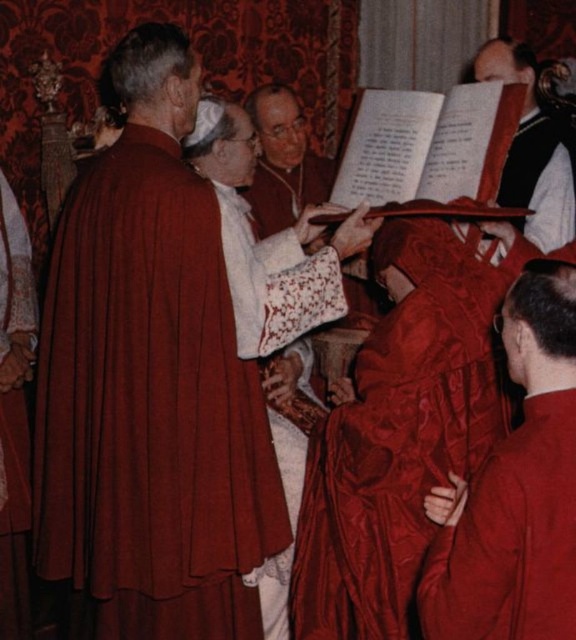
Question: Is matte red robe at left behind satin red robe at left?

Choices:
 (A) no
 (B) yes

Answer: (A)

Question: Is the position of satin red robe at lower right more distant than that of satin red robe at left?

Choices:
 (A) yes
 (B) no

Answer: (B)

Question: Does matte red robe at left have a smaller size compared to satin red robe at lower right?

Choices:
 (A) no
 (B) yes

Answer: (A)

Question: Among these objects, which one is nearest to the camera?

Choices:
 (A) satin red robe at left
 (B) satin red robe at lower right
 (C) matte red robe at left
 (D) smooth black vest at upper right

Answer: (B)

Question: Which point appears closest to the camera in this image?

Choices:
 (A) (1, 392)
 (B) (511, 163)
 (C) (229, 570)
 (D) (570, 381)

Answer: (D)

Question: Among these points, which one is farthest from the camera?

Choices:
 (A) (146, 134)
 (B) (555, 589)
 (C) (20, 621)

Answer: (C)